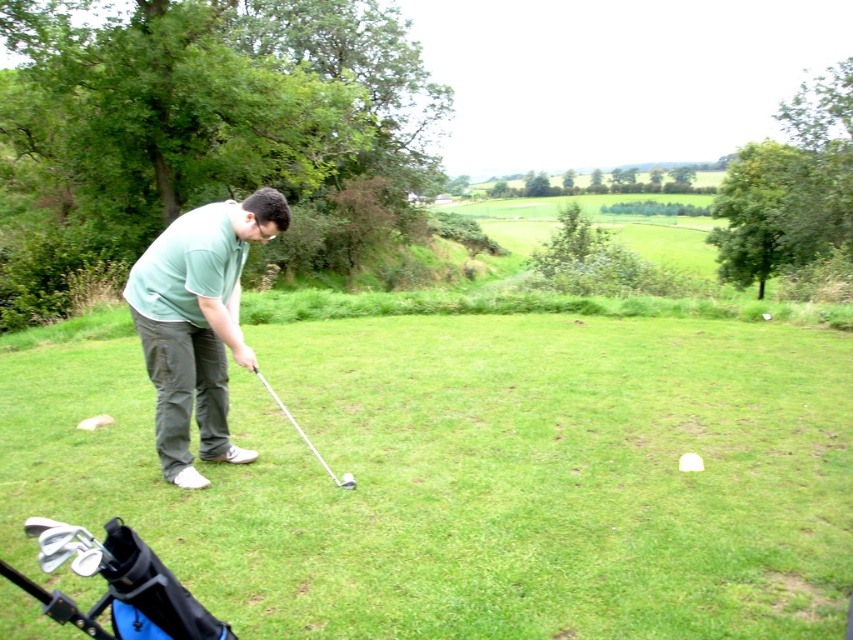
Question: Is white matte golf at center wider than shiny silver golf club at center?

Choices:
 (A) no
 (B) yes

Answer: (B)

Question: Which of the following is the farthest from the observer?

Choices:
 (A) (206, 282)
 (B) (341, 477)

Answer: (B)

Question: Which object is positioned farthest from the green matte shirt at center?

Choices:
 (A) metallic silver golf club at center
 (B) green grass at center

Answer: (B)

Question: Does white matte golf at center have a smaller size compared to shiny silver golf club at center?

Choices:
 (A) yes
 (B) no

Answer: (B)

Question: Does green grass at center have a greater width compared to metallic silver golf club at center?

Choices:
 (A) yes
 (B) no

Answer: (A)

Question: Which of these objects is positioned farthest from the shiny silver golf club at center?

Choices:
 (A) metallic silver golf club at center
 (B) green matte shirt at center

Answer: (B)